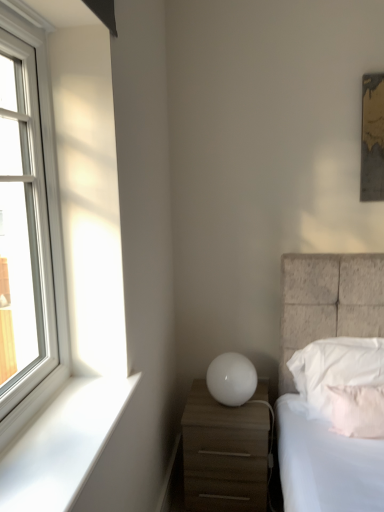
At what (x,y) coordinates should I click in order to perform the action: click on vacant area on top of white matte nightstand at lower right (from a real-world perspective). Please return your answer as a coordinate pair (x, y). Looking at the image, I should click on (226, 407).